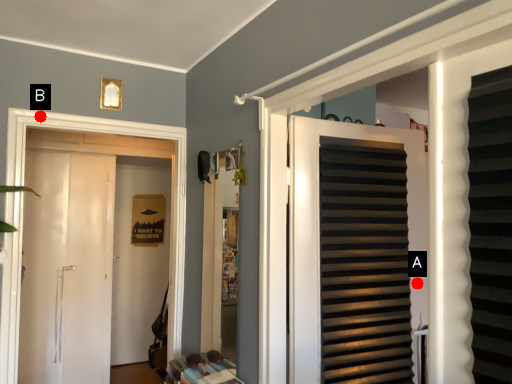
Question: Two points are circled on the image, labeled by A and B beside each circle. Which point is further to the camera?

Choices:
 (A) A is further
 (B) B is further

Answer: (B)